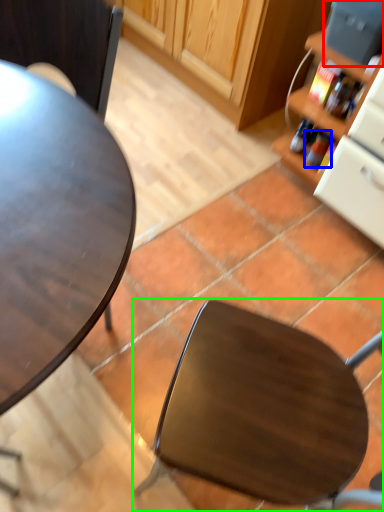
Question: Which object is the closest to the appliance (highlighted by a red box)? Choose among these: bottle (highlighted by a blue box) or chair (highlighted by a green box).

Choices:
 (A) bottle
 (B) chair

Answer: (A)